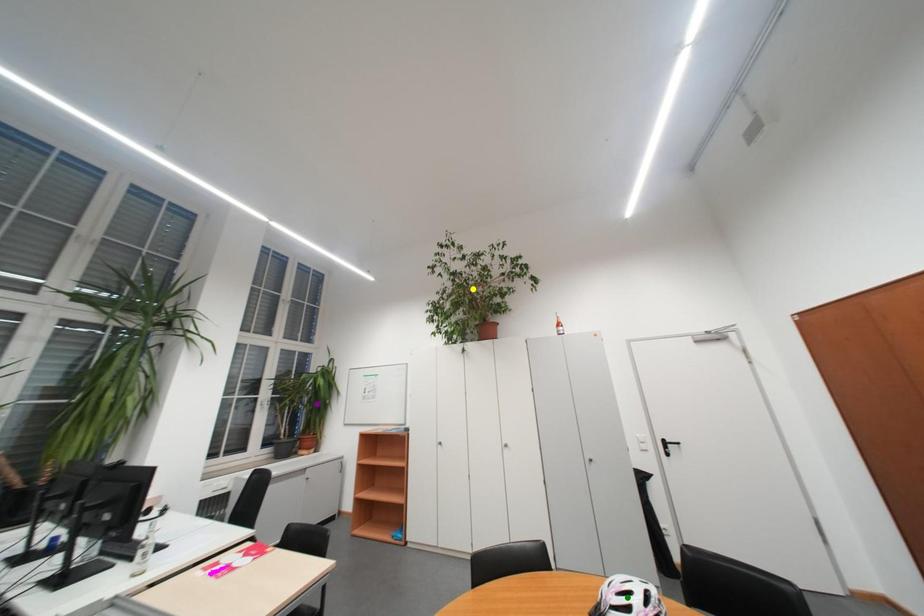
Order these from nearest to farthest:
yellow point, purple point, green point

green point
yellow point
purple point